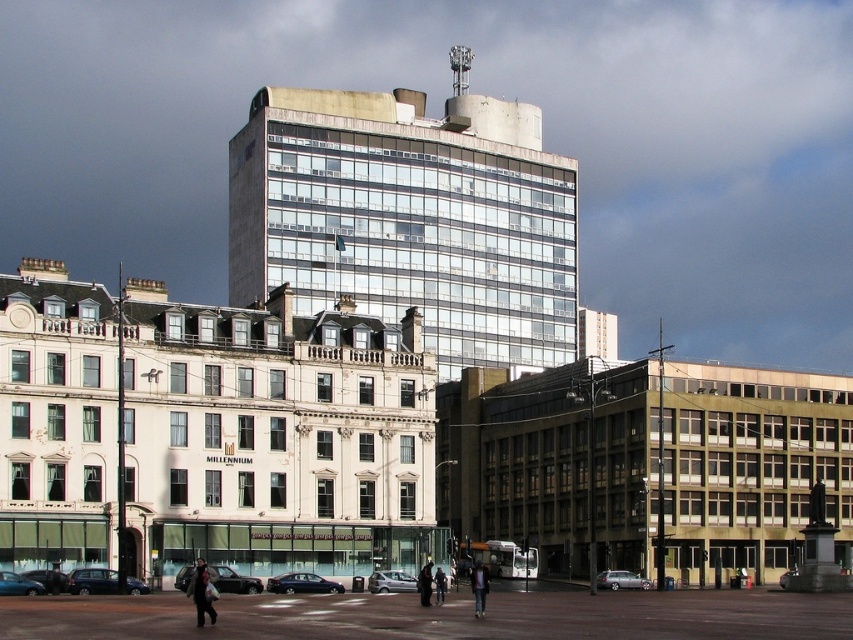
You are standing in the urban scene and want to take a photo of the clear glass building at center without the dark brown leather jacket at center blocking the view. Is it possible to do so based on their sizes?

The clear glass building at center is wider than the dark brown leather jacket at center, so it might be possible to position yourself in a way that the smaller jacket doesn

Consider the image. You are a fashion designer observing a pedestrian wearing a dark gray coat at lower center and dark blue jeans at center. Which clothing item is taller?

The dark gray coat at lower center is taller than the dark blue jeans at center.

You are a photographer standing in the urban scene. You want to capture a photo of the clear glass building at center without any obstructions. Since the dark blue jeans at center are in the way, can you adjust your position to take the shot? Explain why or why not based on their positions.

The clear glass building at center is located above the dark blue jeans at center. Since the building is above the jeans, you can adjust your position to angle your camera upwards to capture the clear glass building at center without the dark blue jeans at center obstructing the view.